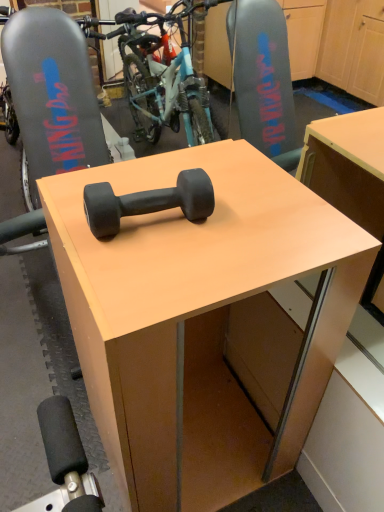
Question: Visually, is black rubber dumbbell at center positioned to the left or to the right of matte black dumbbell at center?

Choices:
 (A) right
 (B) left

Answer: (B)

Question: In terms of size, does black rubber dumbbell at center appear bigger or smaller than matte black dumbbell at center?

Choices:
 (A) big
 (B) small

Answer: (B)

Question: From a real-world perspective, is black rubber dumbbell at center above or below matte black dumbbell at center?

Choices:
 (A) above
 (B) below

Answer: (A)

Question: Would you say matte black dumbbell at center is inside or outside black rubber dumbbell at center?

Choices:
 (A) outside
 (B) inside

Answer: (A)

Question: Based on their sizes in the image, would you say matte black dumbbell at center is bigger or smaller than black rubber dumbbell at center?

Choices:
 (A) small
 (B) big

Answer: (B)

Question: Is matte black dumbbell at center taller or shorter than black rubber dumbbell at center?

Choices:
 (A) tall
 (B) short

Answer: (A)

Question: Is point (238, 270) closer or farther from the camera than point (175, 185)?

Choices:
 (A) farther
 (B) closer

Answer: (B)